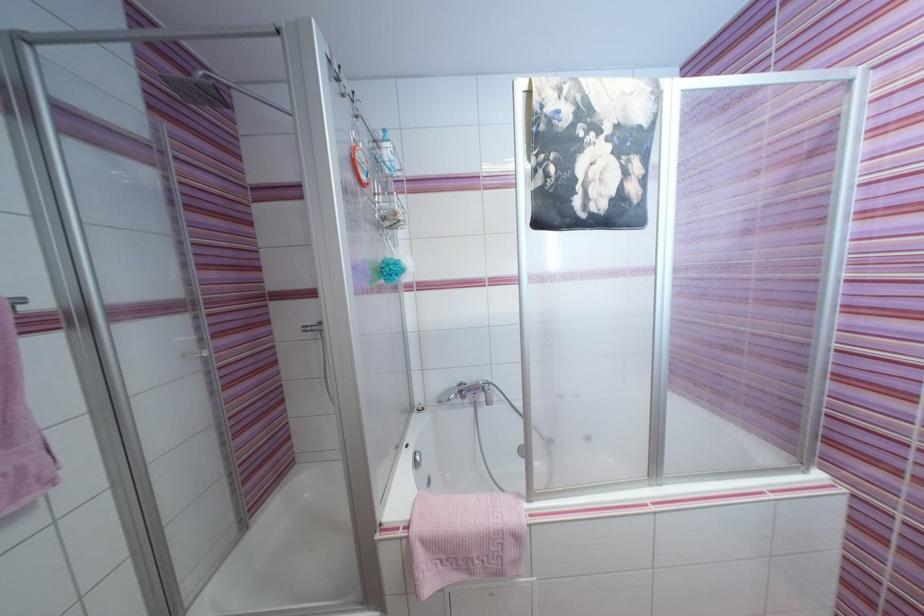
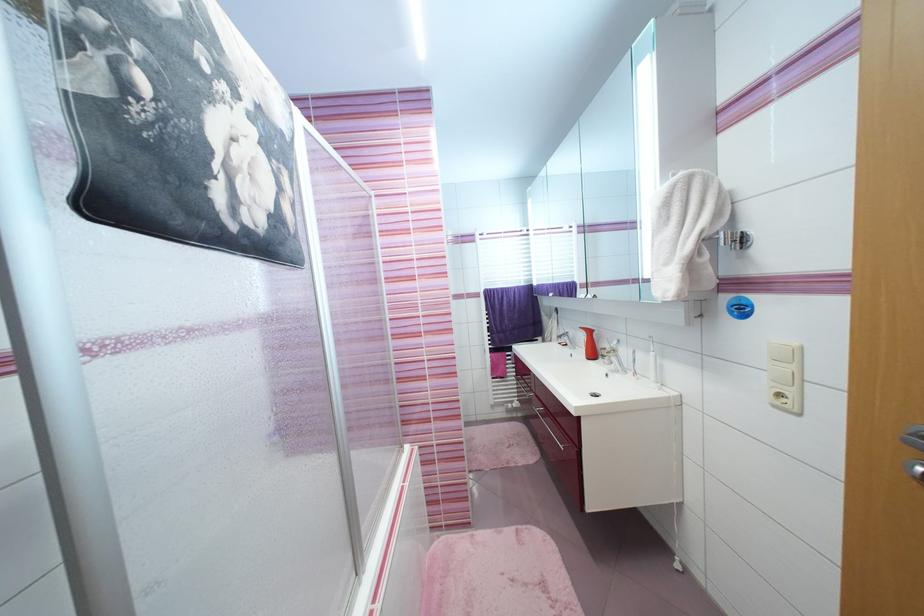
Question: How did the camera likely rotate?

Choices:
 (A) Left
 (B) Right
 (C) Up
 (D) Down

Answer: (B)